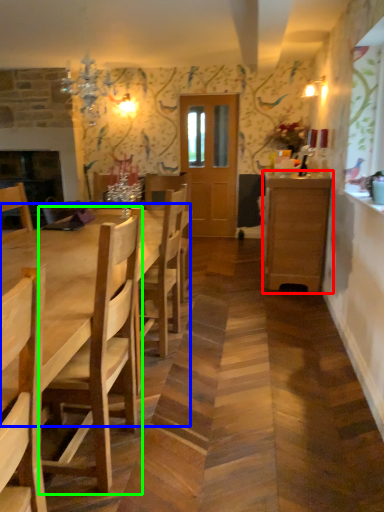
Question: Estimate the real-world distances between objects in this image. Which object is closer to cabinetry (highlighted by a red box), kitchen & dining room table (highlighted by a blue box) or chair (highlighted by a green box)?

Choices:
 (A) kitchen & dining room table
 (B) chair

Answer: (A)